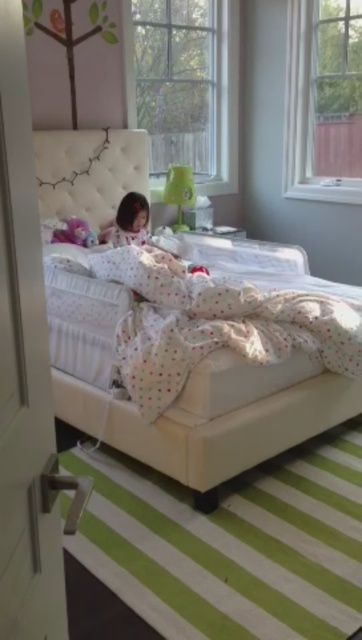
Question: Does white tufted headboard at upper center appear on the left side of soft plush toy at lower left?

Choices:
 (A) yes
 (B) no

Answer: (B)

Question: Which object is positioned farthest from the white tufted headboard at upper center?

Choices:
 (A) white tufted bed at center
 (B) soft plush toy at lower left

Answer: (A)

Question: Can you confirm if white tufted headboard at upper center is wider than soft plush toy at lower left?

Choices:
 (A) no
 (B) yes

Answer: (B)

Question: Estimate the real-world distances between objects in this image. Which object is closer to the white tufted bed at center?

Choices:
 (A) white tufted headboard at upper center
 (B) soft plush toy at lower left

Answer: (B)

Question: Among these objects, which one is farthest from the camera?

Choices:
 (A) white tufted headboard at upper center
 (B) soft plush toy at lower left

Answer: (B)

Question: Is white tufted bed at center bigger than white tufted headboard at upper center?

Choices:
 (A) no
 (B) yes

Answer: (B)